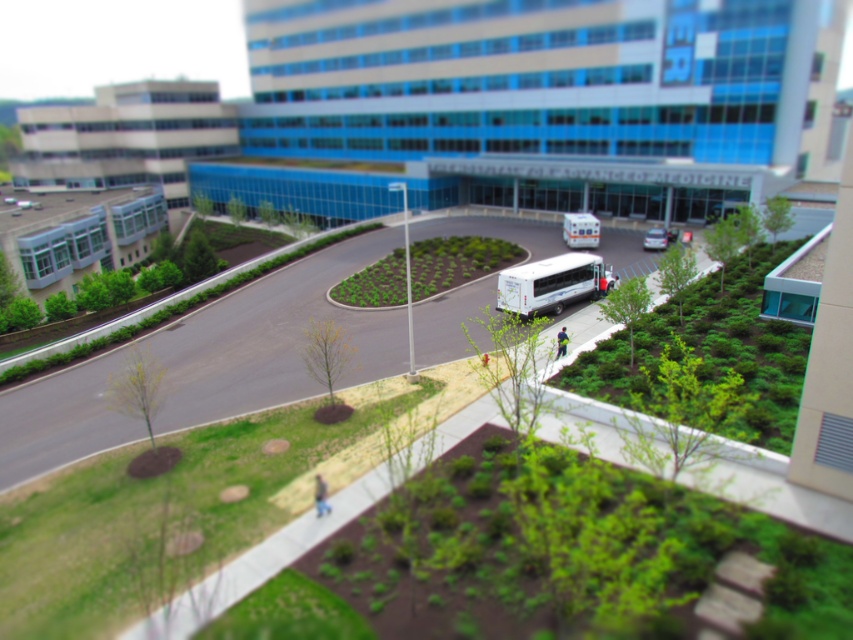
You are a pedestrian standing on the pathway in front of the hospital. You see a white glossy bus at center and a silver metallic van at center. Which vehicle is closer to the left side of the pathway?

The white glossy bus at center is closer to the left side of the pathway because it is positioned to the left of the silver metallic van at center.

You are a delivery person who needs to deliver a package to the hospital. You see a point at coordinates (549,284) in the image. Can you tell me what object this point is located on?

The point at coordinates (549,284) is located on the white matte bus at center.

You are a delivery person who needs to park your vehicle in the hospital parking lot. The parking space you want to use is 2.5 meters wide. You have a choice between the white glossy bus at center and the silver metallic van at center. Which vehicle can fit into the parking space?

The white glossy bus at center is wider than the silver metallic van at center. Since the parking space is 2.5 meters wide, the silver metallic van at center can fit into the parking space, but the white glossy bus at center may be too wide.